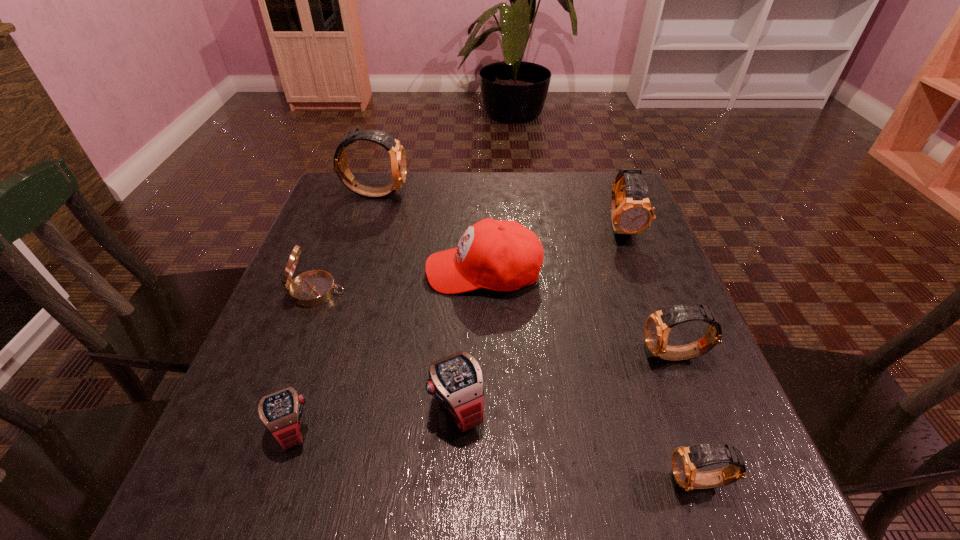
The width and height of the screenshot is (960, 540). I want to click on vacant point located between the baseball cap and the left red watch, so click(x=388, y=350).

I want to click on free space between the compass and the shortest watch, so click(304, 361).

Where is `free space between the third biggest gold watch and the baseball cap`? The width and height of the screenshot is (960, 540). free space between the third biggest gold watch and the baseball cap is located at coordinates (580, 314).

Identify the location of free area in between the baseball cap and the third farthest gold watch. The width and height of the screenshot is (960, 540). (580, 314).

I want to click on free space between the compass and the biggest gold watch, so click(346, 242).

The image size is (960, 540). I want to click on vacant space that's between the right red watch and the farthest object, so click(416, 300).

This screenshot has height=540, width=960. What are the coordinates of `vacant space that's between the fourth watch from right to left and the third farthest gold watch` in the screenshot? It's located at (566, 381).

The width and height of the screenshot is (960, 540). I want to click on empty location between the compass and the third watch from left to right, so pyautogui.click(x=387, y=349).

I want to click on vacant point located between the biggest gold watch and the seventh nearest object, so click(x=498, y=210).

This screenshot has width=960, height=540. What are the coordinates of `object identified as the third closest to the fourth watch from right to left` in the screenshot? It's located at (312, 288).